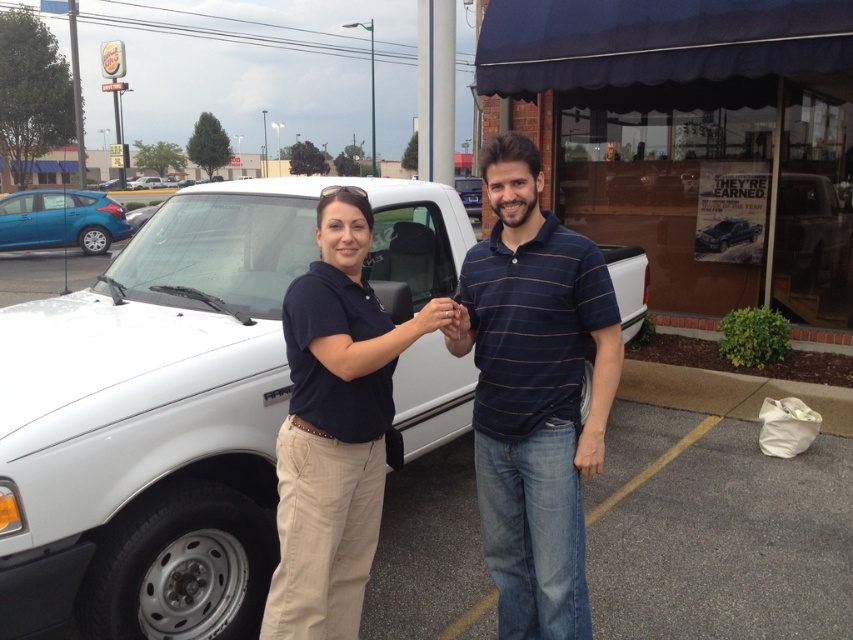
You are a delivery person who needs to park a 18.5 feet long delivery van between the white matte truck at center and the metallic silver truck at center. Based on the scene description, can the van fit between them without overlapping either vehicle?

The white matte truck at center and metallic silver truck at center are 19.15 feet apart from each other. Since the delivery van is 18.5 feet long, it can fit between them as the space is slightly larger than the van.

You are a delivery driver who needs to park your truck in a space that is 2.2 meters wide. You are standing at the camera position and see the white matte truck at center. Can you fit your truck into the parking space?

The white matte truck at center is 2.10 meters from camera. Since the parking space is 2.2 meters wide, your truck can fit into the space as it is slightly wider than the distance from the camera to the truck.

You are a delivery person who needs to park your van in the same spot as the white matte truck at center. What are the coordinates of the parking spot?

The coordinates of the parking spot where the white matte truck at center is located are at point (177, 406).